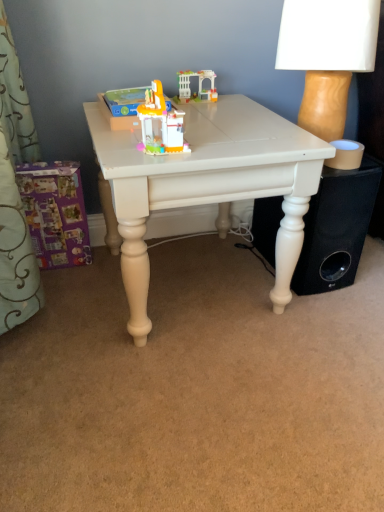
You are a GUI agent. You are given a task and a screenshot of the screen. Output one action in this format:
    pyautogui.click(x=<x>, y=<y>)
    Task: Click on the blank space to the left of translucent plastic toy at center, which is the 2th toy from right to left
    Image resolution: width=384 pixels, height=512 pixels.
    Given the screenshot: What is the action you would take?
    pyautogui.click(x=114, y=146)